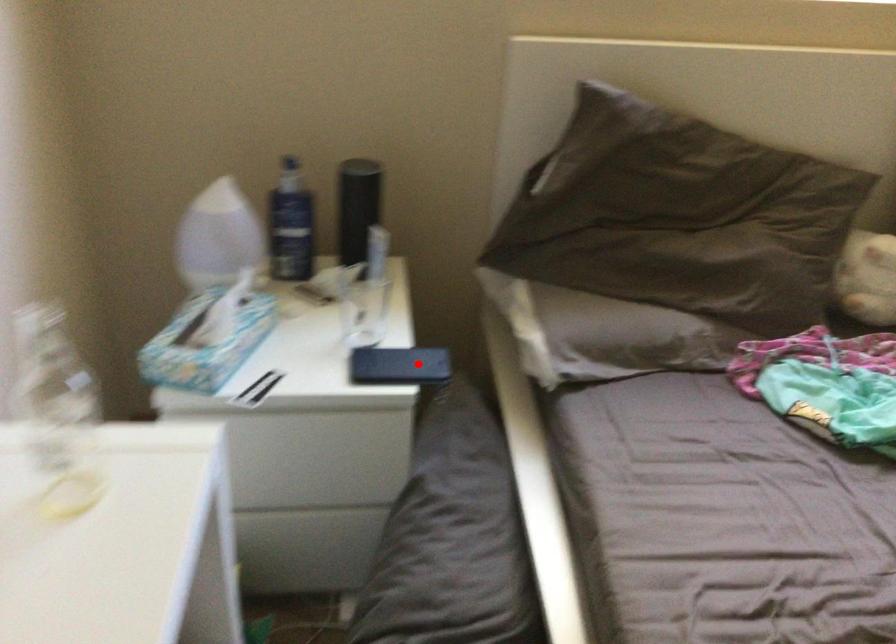
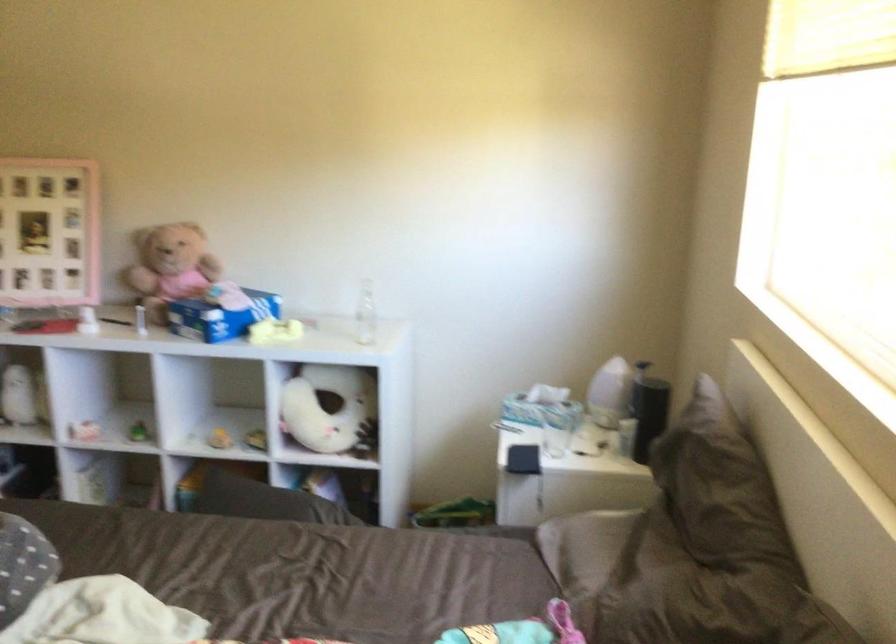
Question: I am providing you with two images of the same scene from different viewpoints. A red point is shown in image1. For the corresponding object point in image2, is it positioned nearer or farther from the camera?

Choices:
 (A) Nearer
 (B) Farther

Answer: (B)